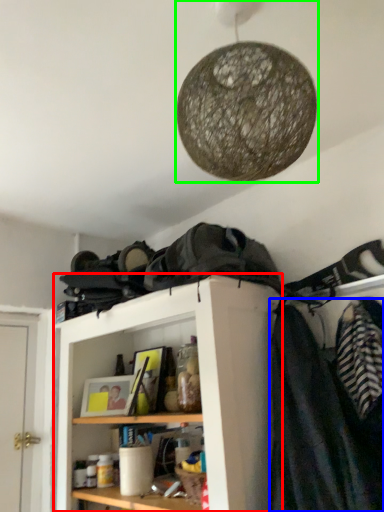
Question: Based on their relative distances, which object is farther from shelf (highlighted by a red box)? Choose from clothing (highlighted by a blue box) and lamp (highlighted by a green box).

Choices:
 (A) clothing
 (B) lamp

Answer: (B)